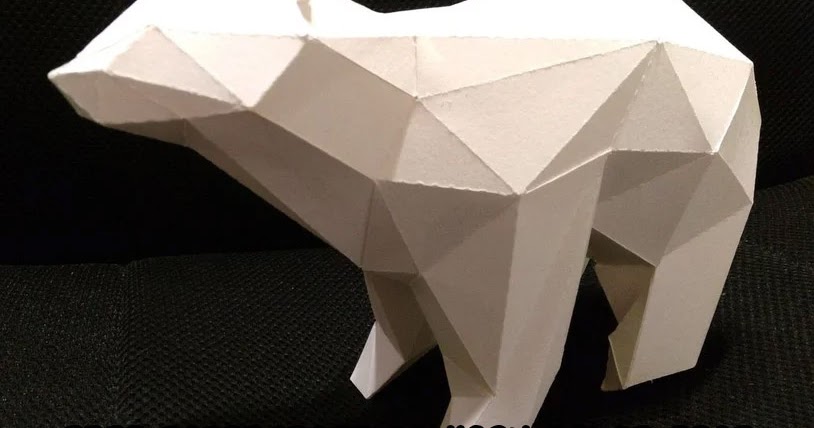
Where is `floor space under the bear`? floor space under the bear is located at coordinates (418, 384), (592, 332).